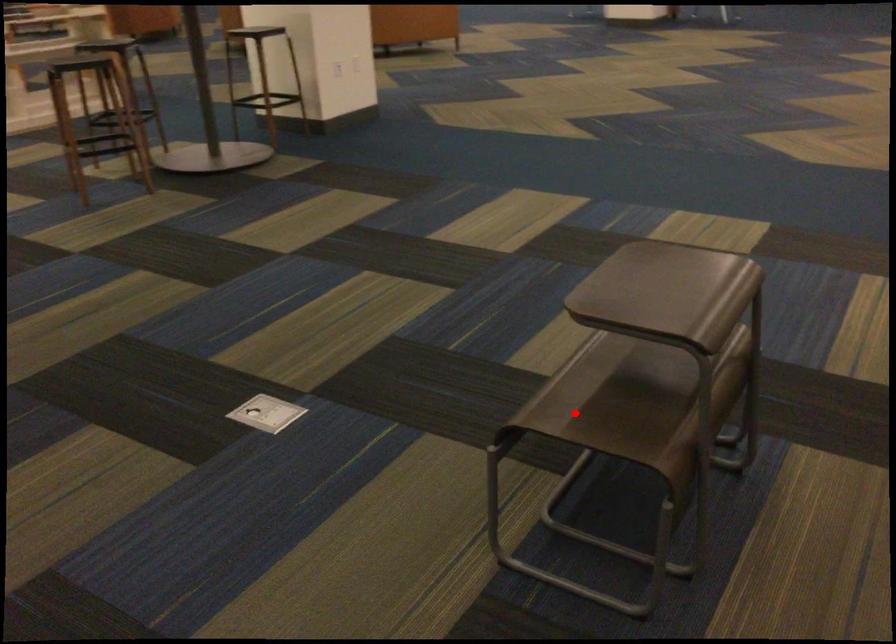
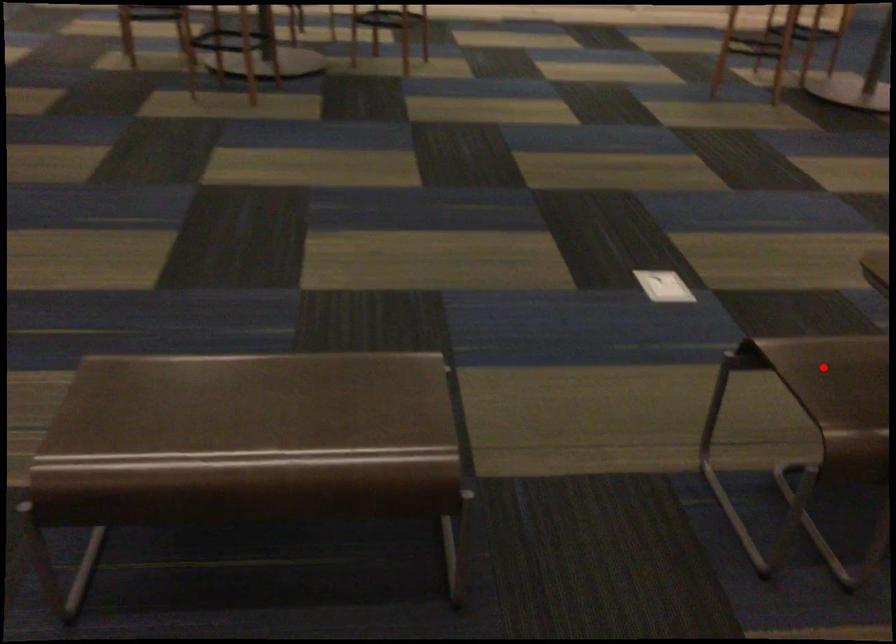
I am providing you with two images of the same scene from different viewpoints. A red point is marked on the first image and another point is marked on the second image. Is the marked point in image1 the same physical position as the marked point in image2?

Yes